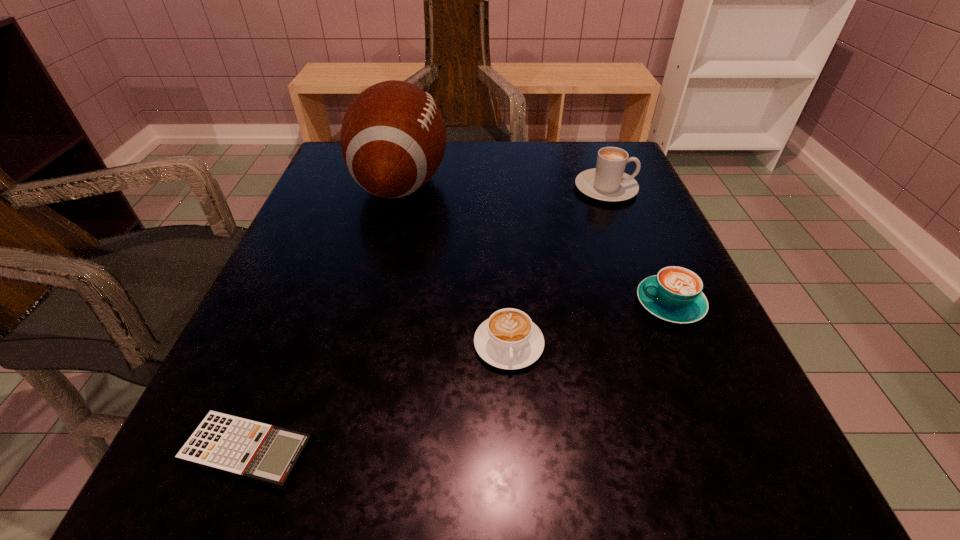
Locate an element on the screen. Image resolution: width=960 pixels, height=540 pixels. cappuccino at the far edge is located at coordinates (607, 182).

I want to click on object situated at the near edge, so click(x=252, y=450).

What are the coordinates of `football situated at the left edge` in the screenshot? It's located at pyautogui.click(x=393, y=138).

Find the location of `calculator located in the left edge section of the desktop`. calculator located in the left edge section of the desktop is located at coordinates (252, 450).

You are a GUI agent. You are given a task and a screenshot of the screen. Output one action in this format:
    pyautogui.click(x=<x>, y=<y>)
    Task: Click on the object positioned at the far left corner
    The height and width of the screenshot is (540, 960).
    Given the screenshot: What is the action you would take?
    pyautogui.click(x=393, y=138)

Locate an element on the screen. object that is at the near left corner is located at coordinates (252, 450).

Locate an element on the screen. object that is at the far right corner is located at coordinates (607, 182).

Locate an element on the screen. This screenshot has width=960, height=540. vacant space at the far edge of the desktop is located at coordinates (505, 158).

Where is `free space at the near edge of the desktop`? The image size is (960, 540). free space at the near edge of the desktop is located at coordinates (311, 505).

Identify the location of free space at the left edge of the desktop. This screenshot has width=960, height=540. (351, 245).